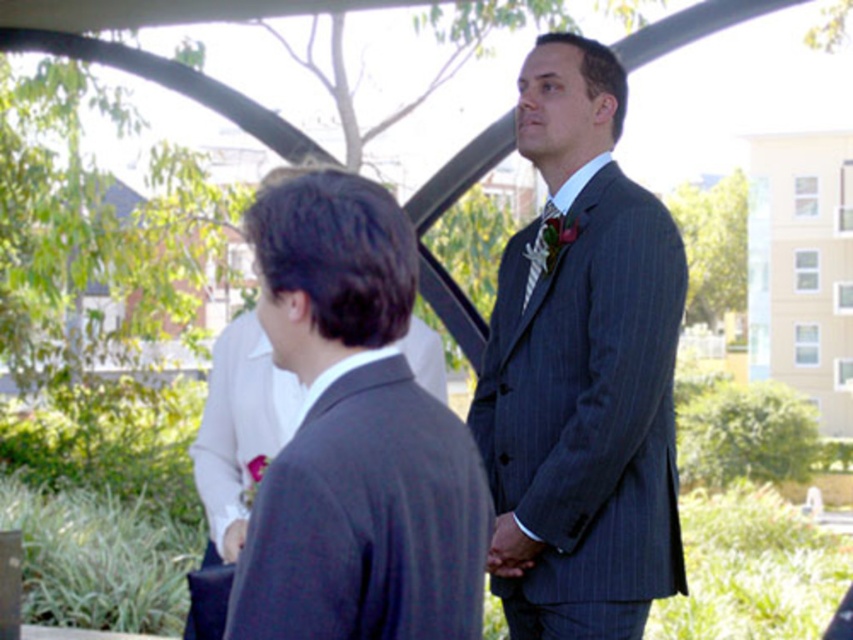
Question: Among these points, which one is farthest from the camera?

Choices:
 (A) (335, 540)
 (B) (500, 387)
 (C) (547, 252)

Answer: (B)

Question: Among these points, which one is nearest to the camera?

Choices:
 (A) (656, 538)
 (B) (407, 433)
 (C) (552, 208)

Answer: (B)

Question: Which object is the closest to the striped silk tie at center?

Choices:
 (A) dark gray suit at center
 (B) pinstriped suit at center

Answer: (B)

Question: Can you confirm if pinstriped suit at center is positioned below striped silk tie at center?

Choices:
 (A) yes
 (B) no

Answer: (A)

Question: In this image, where is pinstriped suit at center located relative to dark gray suit at center?

Choices:
 (A) right
 (B) left

Answer: (A)

Question: Is pinstriped suit at center smaller than dark gray suit at center?

Choices:
 (A) yes
 (B) no

Answer: (B)